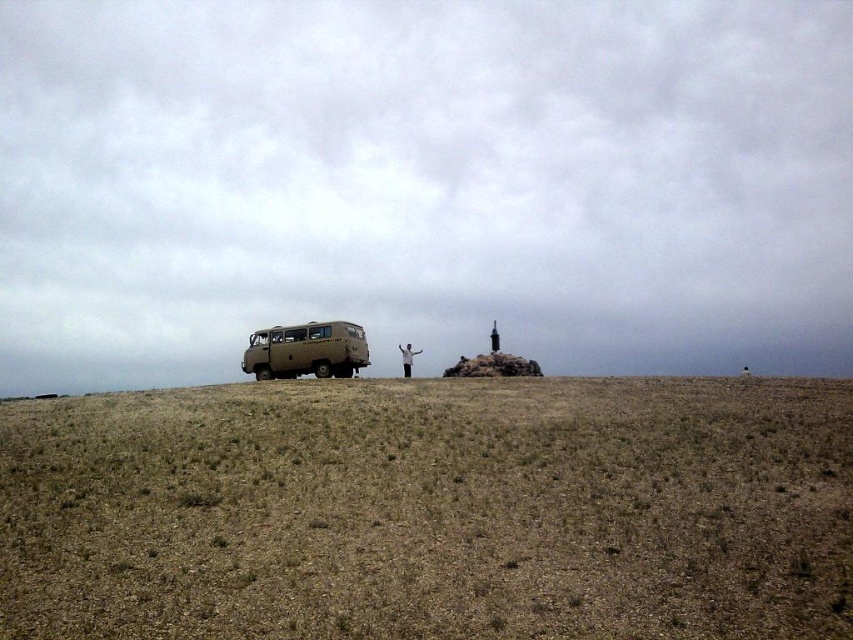
In the scene shown: You are standing at the edge of an open field and see the beige matte van at left and the white matte person at center. Which object is positioned more to the left?

The beige matte van at left is positioned to the left of the white matte person at center, so it is more to the left.

You are standing at the point marked as point (x=431, y=512) in the image. What is the nearest object to you in the scene?

The nearest object to you at point (x=431, y=512) is the brown dry grass at center, as it is located exactly at that coordinate.